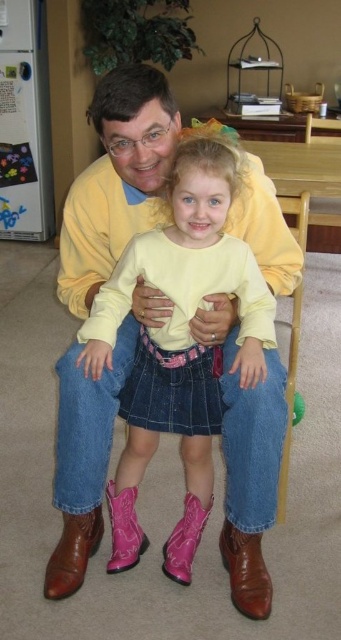
You are standing in the room and see the brown leather boots at lower center and the brown leather boot at lower left. Which one is positioned higher from the ground?

The brown leather boots at lower center is above brown leather boot at lower left, so it is positioned higher from the ground.